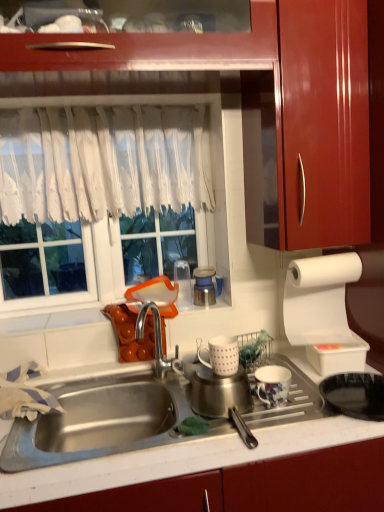
Question: Is glossy wood cabinet at upper right wider than white lace curtain at upper center?

Choices:
 (A) yes
 (B) no

Answer: (A)

Question: Would you say white lace curtain at upper center is part of glossy wood cabinet at upper right's contents?

Choices:
 (A) no
 (B) yes

Answer: (A)

Question: Considering the relative sizes of glossy wood cabinet at upper right and white lace curtain at upper center in the image provided, is glossy wood cabinet at upper right thinner than white lace curtain at upper center?

Choices:
 (A) yes
 (B) no

Answer: (B)

Question: Is glossy wood cabinet at upper right positioned before white lace curtain at upper center?

Choices:
 (A) yes
 (B) no

Answer: (A)

Question: Is glossy wood cabinet at upper right located outside white lace curtain at upper center?

Choices:
 (A) no
 (B) yes

Answer: (B)

Question: Is point (281, 395) closer or farther from the camera than point (349, 99)?

Choices:
 (A) closer
 (B) farther

Answer: (A)

Question: Based on their sizes in the image, would you say floral ceramic mug at lower center, acting as the second tableware starting from the left, is bigger or smaller than glossy wood cabinet at upper right?

Choices:
 (A) big
 (B) small

Answer: (B)

Question: Choose the correct answer: Is floral ceramic mug at lower center, placed as the first tableware when sorted from right to left, inside glossy wood cabinet at upper right or outside it?

Choices:
 (A) outside
 (B) inside

Answer: (A)

Question: Relative to glossy wood cabinet at upper right, is floral ceramic mug at lower center, the 1th tableware from the bottom, in front or behind?

Choices:
 (A) front
 (B) behind

Answer: (B)

Question: Considering the positions of black matte frying pan at lower right and white paper at right in the image, is black matte frying pan at lower right taller or shorter than white paper at right?

Choices:
 (A) tall
 (B) short

Answer: (B)

Question: In terms of width, does black matte frying pan at lower right look wider or thinner when compared to white paper at right?

Choices:
 (A) thin
 (B) wide

Answer: (B)

Question: From a real-world perspective, is black matte frying pan at lower right physically located above or below white paper at right?

Choices:
 (A) below
 (B) above

Answer: (A)

Question: Do you think black matte frying pan at lower right is within white paper at right, or outside of it?

Choices:
 (A) outside
 (B) inside

Answer: (A)

Question: Looking at their shapes, would you say floral ceramic mug at lower center, placed as the first tableware when sorted from right to left, is wider or thinner than metallic blue thermos at center, which is the 1th appliance from top to bottom?

Choices:
 (A) wide
 (B) thin

Answer: (A)

Question: From the image's perspective, is floral ceramic mug at lower center, the 2th tableware in the top-to-bottom sequence, positioned above or below metallic blue thermos at center, which is the 1th appliance from top to bottom?

Choices:
 (A) above
 (B) below

Answer: (B)